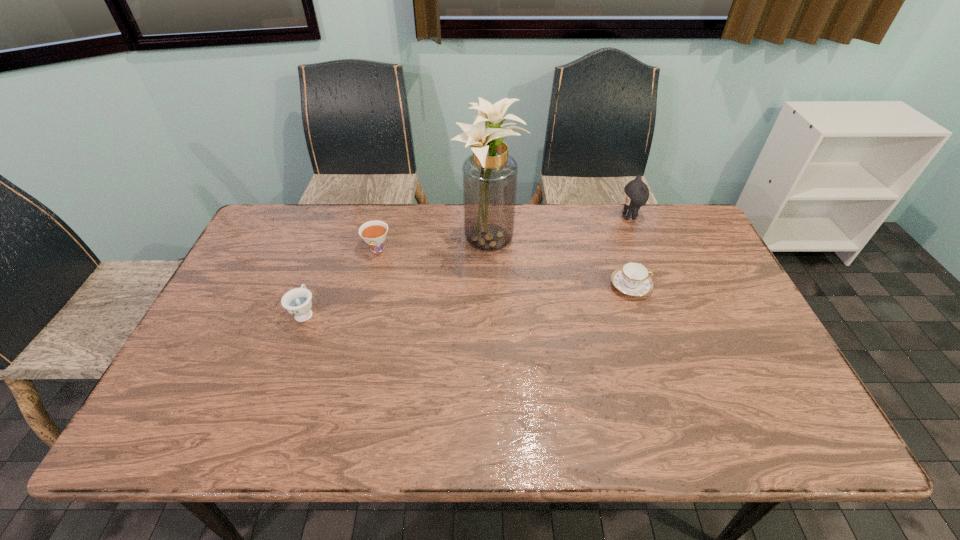
The height and width of the screenshot is (540, 960). Find the location of `vacant space that satisfies the following two spatial constraints: 1. on the front-facing side of the second tallest object; 2. on the side of the farthest teacup with the handle`. vacant space that satisfies the following two spatial constraints: 1. on the front-facing side of the second tallest object; 2. on the side of the farthest teacup with the handle is located at coordinates (642, 249).